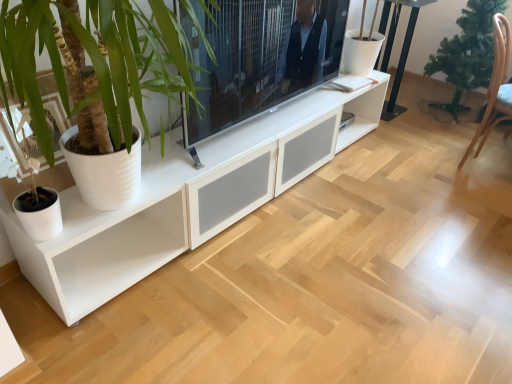
The height and width of the screenshot is (384, 512). Identify the location of vacant space underneath brown wooden armchair at right (from a real-world perspective). (487, 162).